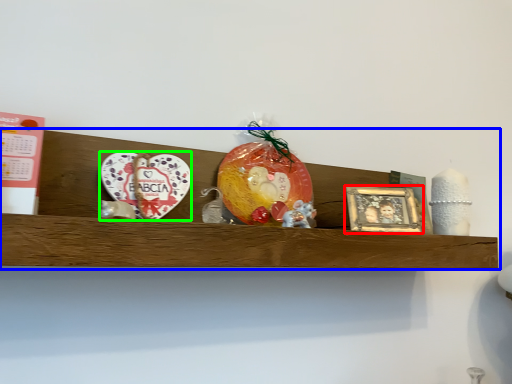
Question: Considering the real-world distances, which object is farthest from picture frame (highlighted by a red box)? shelf (highlighted by a blue box) or platter (highlighted by a green box)?

Choices:
 (A) shelf
 (B) platter

Answer: (B)